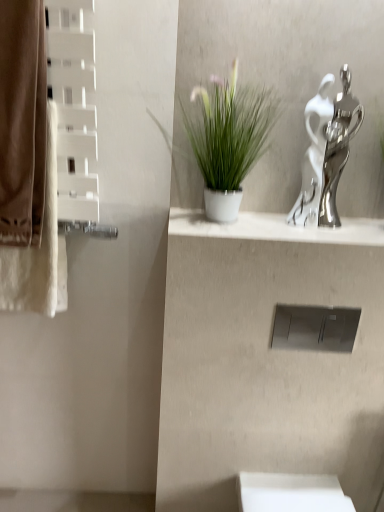
Locate an element on the screen. This screenshot has height=512, width=384. free point above white glossy vase at upper center (from a real-world perspective) is located at coordinates (281, 221).